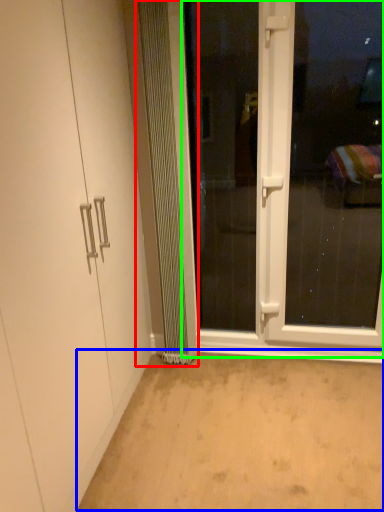
Question: Estimate the real-world distances between objects in this image. Which object is farther from radiator (highlighted by a red box), plain (highlighted by a blue box) or screen door (highlighted by a green box)?

Choices:
 (A) plain
 (B) screen door

Answer: (A)